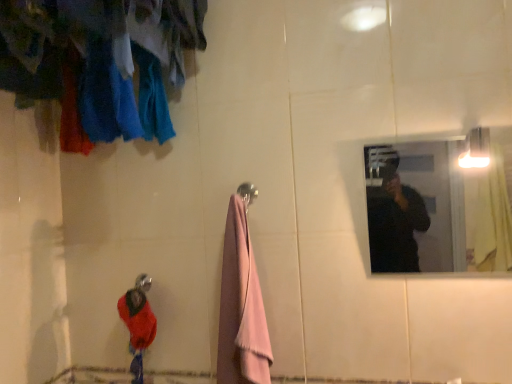
Measure the distance between velvet red sweater at lower left and camera.

velvet red sweater at lower left and camera are 4.57 feet apart.

This screenshot has width=512, height=384. In order to click on brushed metal shower head at lower left in this screenshot , I will do `click(143, 282)`.

What are the coordinates of `velvet red sweater at lower left` in the screenshot? It's located at (137, 319).

From a real-world perspective, relative to brushed metal shower head at lower left, is metallic reflective mirror at upper right vertically above or below?

In terms of real-world spatial position, metallic reflective mirror at upper right is above brushed metal shower head at lower left.

Is metallic reflective mirror at upper right oriented away from brushed metal shower head at lower left?

metallic reflective mirror at upper right is not turned away from brushed metal shower head at lower left.

From the image's perspective, which object appears higher, metallic reflective mirror at upper right or brushed metal shower head at lower left?

From the image's view, metallic reflective mirror at upper right is above.

Consider the image. Does metallic reflective mirror at upper right have a lesser height compared to brushed metal shower head at lower left?

Incorrect, the height of metallic reflective mirror at upper right does not fall short of that of brushed metal shower head at lower left.

From the picture: From the image's perspective, is velvet red sweater at lower left below metallic reflective mirror at upper right?

Correct, velvet red sweater at lower left appears lower than metallic reflective mirror at upper right in the image.

The height and width of the screenshot is (384, 512). I want to click on mirror located above the velvet red sweater at lower left (from a real-world perspective), so (437, 208).

Which is behind, point (141, 317) or point (389, 241)?

The point (389, 241) is farther from the camera.

Relative to metallic reflective mirror at upper right, is velvet red sweater at lower left in front or behind?

Clearly, velvet red sweater at lower left is behind metallic reflective mirror at upper right.

Locate an element on the screen. The height and width of the screenshot is (384, 512). clothing located on the left of pink fluffy towel at center is located at coordinates (137, 319).

Which of these two, pink fluffy towel at center or velvet red sweater at lower left, is wider?

Wider between the two is pink fluffy towel at center.

Is pink fluffy towel at center further to the viewer compared to velvet red sweater at lower left?

A: No.

From a real-world perspective, is brushed metal shower head at lower left physically above velvet red sweater at lower left?

Indeed, from a real-world perspective, brushed metal shower head at lower left stands above velvet red sweater at lower left.

Which is behind, point (150, 287) or point (151, 330)?

The point (150, 287) is more distant.

Is brushed metal shower head at lower left in front of or behind velvet red sweater at lower left in the image?

brushed metal shower head at lower left is behind velvet red sweater at lower left.

From the image's perspective, would you say velvet red sweater at lower left is shown under pink fluffy towel at center?

Correct, velvet red sweater at lower left appears lower than pink fluffy towel at center in the image.

Is velvet red sweater at lower left inside the boundaries of pink fluffy towel at center, or outside?

velvet red sweater at lower left is outside pink fluffy towel at center.

Is metallic reflective mirror at upper right facing towards pink fluffy towel at center?

No, metallic reflective mirror at upper right does not turn towards pink fluffy towel at center.

Where is `towel/napkin that appears on the left of metallic reflective mirror at upper right`? The width and height of the screenshot is (512, 384). towel/napkin that appears on the left of metallic reflective mirror at upper right is located at coordinates (241, 307).

Is the surface of metallic reflective mirror at upper right in direct contact with pink fluffy towel at center?

They are not placed beside each other.

Is metallic reflective mirror at upper right thinner than pink fluffy towel at center?

Indeed, metallic reflective mirror at upper right has a lesser width compared to pink fluffy towel at center.

Where is `shower above the velvet red sweater at lower left (from the image's perspective)`? shower above the velvet red sweater at lower left (from the image's perspective) is located at coordinates (143, 282).

Is velvet red sweater at lower left smaller than brushed metal shower head at lower left?

Incorrect, velvet red sweater at lower left is not smaller in size than brushed metal shower head at lower left.

In the image, is velvet red sweater at lower left on the left side or the right side of brushed metal shower head at lower left?

velvet red sweater at lower left is to the right of brushed metal shower head at lower left.

Is velvet red sweater at lower left facing towards brushed metal shower head at lower left?

No.

At what (x,y) coordinates should I click in order to perform the action: click on mirror on the right of brushed metal shower head at lower left. Please return your answer as a coordinate pair (x, y). Image resolution: width=512 pixels, height=384 pixels. Looking at the image, I should click on (437, 208).

This screenshot has height=384, width=512. I want to click on mirror in front of the velvet red sweater at lower left, so click(x=437, y=208).

Based on their spatial positions, is pink fluffy towel at center or metallic reflective mirror at upper right further from velvet red sweater at lower left?

metallic reflective mirror at upper right.

Based on their spatial positions, is brushed metal shower head at lower left or velvet red sweater at lower left further from pink fluffy towel at center?

The object further to pink fluffy towel at center is brushed metal shower head at lower left.

Considering their positions, is pink fluffy towel at center positioned further to metallic reflective mirror at upper right than velvet red sweater at lower left?

Based on the image, velvet red sweater at lower left appears to be further to metallic reflective mirror at upper right.

Which object lies nearer to the anchor point brushed metal shower head at lower left, pink fluffy towel at center or velvet red sweater at lower left?

velvet red sweater at lower left is positioned closer to the anchor brushed metal shower head at lower left.

When comparing their distances from velvet red sweater at lower left, does metallic reflective mirror at upper right or pink fluffy towel at center seem further?

Among the two, metallic reflective mirror at upper right is located further to velvet red sweater at lower left.

From the image, which object appears to be nearer to metallic reflective mirror at upper right, brushed metal shower head at lower left or pink fluffy towel at center?

Based on the image, pink fluffy towel at center appears to be nearer to metallic reflective mirror at upper right.

Considering their positions, is brushed metal shower head at lower left positioned closer to velvet red sweater at lower left than pink fluffy towel at center?

brushed metal shower head at lower left is positioned closer to the anchor velvet red sweater at lower left.

Which object lies further to the anchor point brushed metal shower head at lower left, velvet red sweater at lower left or pink fluffy towel at center?

pink fluffy towel at center is further to brushed metal shower head at lower left.

Where is `towel/napkin between velvet red sweater at lower left and metallic reflective mirror at upper right`? This screenshot has height=384, width=512. towel/napkin between velvet red sweater at lower left and metallic reflective mirror at upper right is located at coordinates (241, 307).

I want to click on clothing between brushed metal shower head at lower left and metallic reflective mirror at upper right, so click(x=137, y=319).

The height and width of the screenshot is (384, 512). Find the location of `towel/napkin situated between brushed metal shower head at lower left and metallic reflective mirror at upper right from left to right`. towel/napkin situated between brushed metal shower head at lower left and metallic reflective mirror at upper right from left to right is located at coordinates (241, 307).

Locate an element on the screen. The width and height of the screenshot is (512, 384). clothing between brushed metal shower head at lower left and pink fluffy towel at center in the horizontal direction is located at coordinates (137, 319).